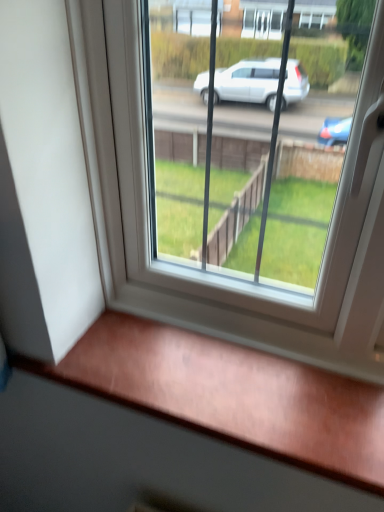
Where is `blank space above wooden at lower center (from a real-world perspective)`? This screenshot has height=512, width=384. blank space above wooden at lower center (from a real-world perspective) is located at coordinates (197, 374).